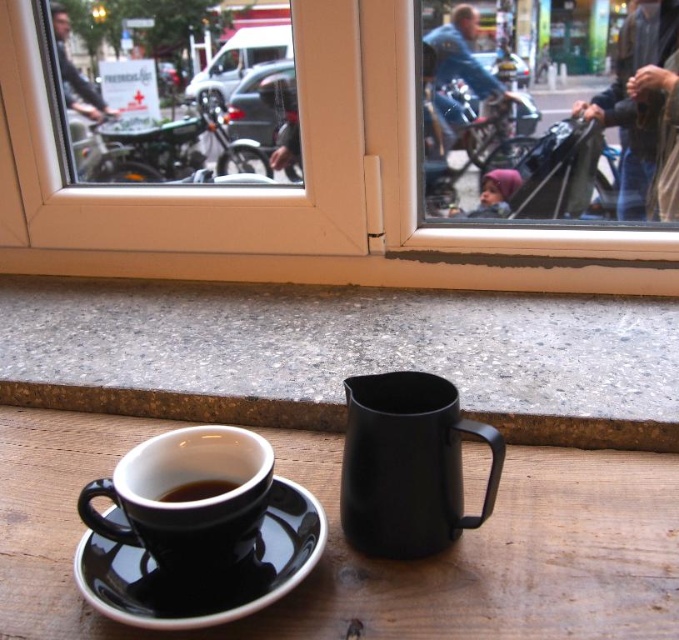
Is the position of transparent glass window at center less distant than that of black ceramic saucer at lower left?

No, it is not.

From the picture: Is transparent glass window at center smaller than black ceramic saucer at lower left?

No.

Which is in front, point (200, 278) or point (96, 572)?

Point (96, 572) is in front.

Locate an element on the screen. The width and height of the screenshot is (679, 640). transparent glass window at center is located at coordinates (293, 189).

Is black matte pitcher at center positioned behind black glossy cup at lower left?

No, it is not.

Find the location of a particular element. Image resolution: width=679 pixels, height=640 pixels. black matte pitcher at center is located at coordinates (407, 465).

Who is more distant from viewer, (435, 468) or (164, 499)?

Positioned behind is point (164, 499).

The image size is (679, 640). In order to click on black matte pitcher at center in this screenshot , I will do coord(407,465).

Does point (428, 456) come closer to viewer compared to point (122, 502)?

No.

Is black matte pitcher at center in front of black matte mug at lower left?

No, it is behind black matte mug at lower left.

Where is `black matte pitcher at center`? The width and height of the screenshot is (679, 640). black matte pitcher at center is located at coordinates (407, 465).

Where is `black matte pitcher at center`? black matte pitcher at center is located at coordinates (407, 465).